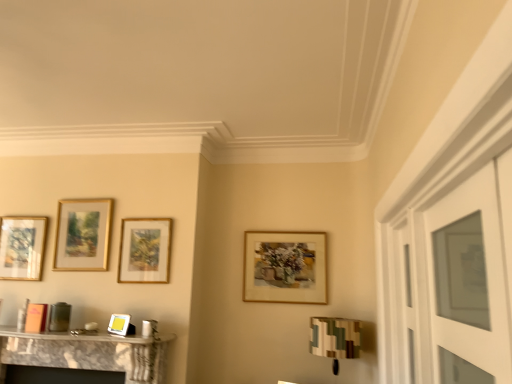
Question: Does wooden picture frame at center, the 4th picture frame when ordered from left to right, have a lesser height compared to gold-framed picture at left, placed as the fourth picture frame when sorted from right to left?

Choices:
 (A) yes
 (B) no

Answer: (B)

Question: Is wooden picture frame at center, the 4th picture frame when ordered from left to right, bigger than gold-framed picture at left, which is the 1th picture frame in left-to-right order?

Choices:
 (A) yes
 (B) no

Answer: (A)

Question: Considering the relative sizes of wooden picture frame at center, the first picture frame positioned from the right, and gold-framed picture at left, which is the 1th picture frame in left-to-right order, in the image provided, is wooden picture frame at center, the first picture frame positioned from the right, smaller than gold-framed picture at left, which is the 1th picture frame in left-to-right order,?

Choices:
 (A) no
 (B) yes

Answer: (A)

Question: Considering the relative sizes of wooden picture frame at center, the 4th picture frame when ordered from left to right, and gold-framed picture at left, which is the 1th picture frame in left-to-right order, in the image provided, is wooden picture frame at center, the 4th picture frame when ordered from left to right, thinner than gold-framed picture at left, which is the 1th picture frame in left-to-right order,?

Choices:
 (A) yes
 (B) no

Answer: (A)

Question: From a real-world perspective, is wooden picture frame at center, the 4th picture frame when ordered from left to right, located higher than gold-framed picture at left, placed as the fourth picture frame when sorted from right to left?

Choices:
 (A) no
 (B) yes

Answer: (A)

Question: Can you confirm if wooden picture frame at center, the first picture frame positioned from the right, is positioned to the left of gold-framed picture at left, which is the 1th picture frame in left-to-right order?

Choices:
 (A) yes
 (B) no

Answer: (B)

Question: Can you confirm if camouflage fabric lampshade at lower right is shorter than clear glass door at right?

Choices:
 (A) yes
 (B) no

Answer: (A)

Question: Considering the relative sizes of camouflage fabric lampshade at lower right and clear glass door at right in the image provided, is camouflage fabric lampshade at lower right bigger than clear glass door at right?

Choices:
 (A) no
 (B) yes

Answer: (B)

Question: Is camouflage fabric lampshade at lower right facing towards clear glass door at right?

Choices:
 (A) no
 (B) yes

Answer: (B)

Question: From the image's perspective, is camouflage fabric lampshade at lower right on top of clear glass door at right?

Choices:
 (A) no
 (B) yes

Answer: (A)

Question: Is camouflage fabric lampshade at lower right positioned behind clear glass door at right?

Choices:
 (A) yes
 (B) no

Answer: (A)

Question: Can you confirm if camouflage fabric lampshade at lower right is positioned to the left of clear glass door at right?

Choices:
 (A) no
 (B) yes

Answer: (B)

Question: Considering the relative sizes of gold/glossy picture frame at upper left, which is the 3th picture frame from right to left, and wooden picture frame at center, the first picture frame positioned from the right, in the image provided, is gold/glossy picture frame at upper left, which is the 3th picture frame from right to left, bigger than wooden picture frame at center, the first picture frame positioned from the right,?

Choices:
 (A) no
 (B) yes

Answer: (A)